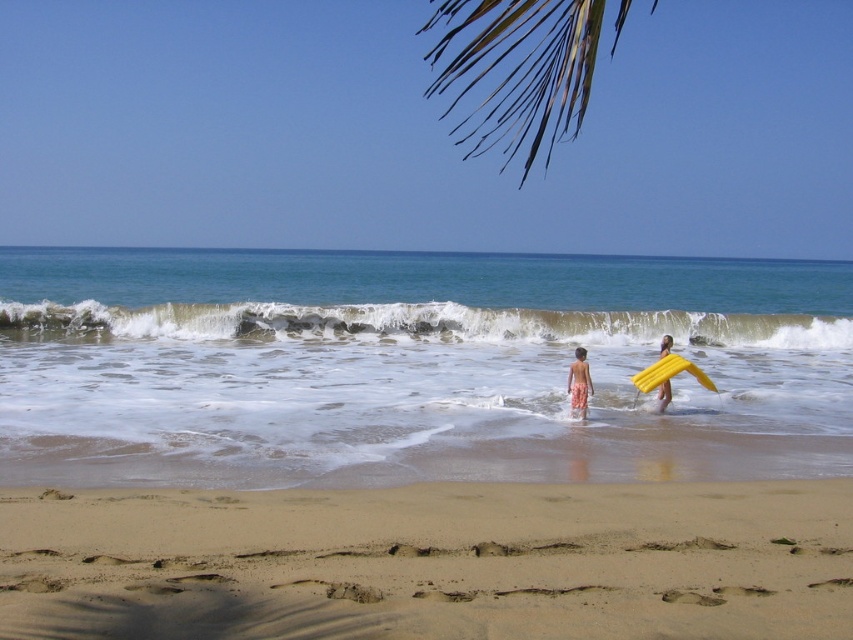
Question: Does yellow foam surfboard at right have a greater width compared to yellow foam surfboard at lower right?

Choices:
 (A) yes
 (B) no

Answer: (A)

Question: Among these objects, which one is nearest to the camera?

Choices:
 (A) clear blue water at center
 (B) white foam wave at center
 (C) orange printed shorts at lower center
 (D) yellow foam surfboard at right

Answer: (A)

Question: Which point is closer to the camera taking this photo?

Choices:
 (A) (581, 380)
 (B) (730, 545)
 (C) (518, 134)
 (D) (193, 348)

Answer: (B)

Question: Does fine-grained sand at lower center come in front of yellow foam surfboard at right?

Choices:
 (A) no
 (B) yes

Answer: (B)

Question: Estimate the real-world distances between objects in this image. Which object is closer to the fine-grained sand at lower center?

Choices:
 (A) clear blue water at center
 (B) green leafy palm at upper center
 (C) orange printed shorts at lower center

Answer: (C)

Question: Is clear blue water at center below white foam wave at center?

Choices:
 (A) yes
 (B) no

Answer: (B)